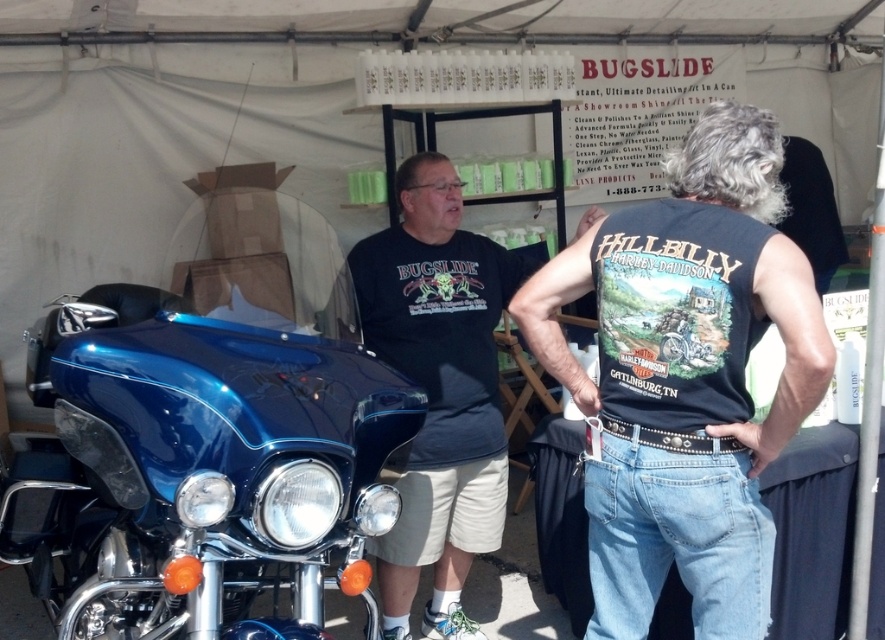
Question: Can you confirm if glossy blue motorcycle at left is wider than denim jeans at center?

Choices:
 (A) yes
 (B) no

Answer: (A)

Question: Which of the following is the farthest from the observer?

Choices:
 (A) (227, 481)
 (B) (391, 529)
 (C) (612, 356)

Answer: (B)

Question: Can you confirm if denim jeans at center is bigger than matte black t-shirt at center?

Choices:
 (A) yes
 (B) no

Answer: (B)

Question: Which object is farther from the camera taking this photo?

Choices:
 (A) glossy blue motorcycle at left
 (B) denim jeans at center
 (C) matte black t-shirt at center

Answer: (C)

Question: Considering the real-world distances, which object is closest to the glossy blue motorcycle at left?

Choices:
 (A) matte black t-shirt at center
 (B) denim jeans at center

Answer: (B)

Question: Considering the relative positions of denim jeans at center and matte black t-shirt at center in the image provided, where is denim jeans at center located with respect to matte black t-shirt at center?

Choices:
 (A) right
 (B) left

Answer: (A)